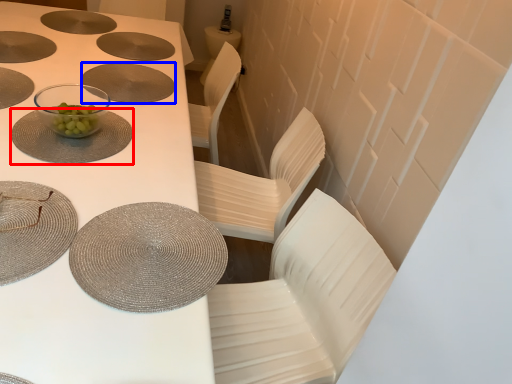
Question: Which point is closer to the camera, tableware (highlighted by a red box) or plate (highlighted by a blue box)?

Choices:
 (A) tableware
 (B) plate

Answer: (A)